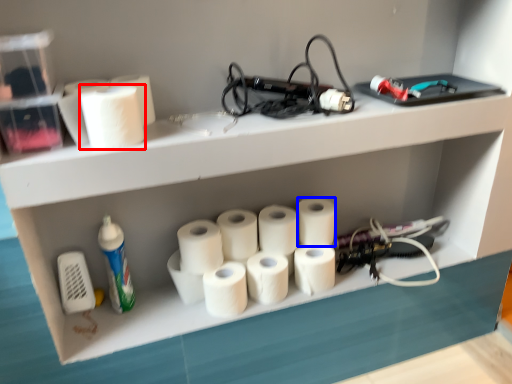
Question: Among these objects, which one is farthest to the camera, paper towel (highlighted by a red box) or paper towel (highlighted by a blue box)?

Choices:
 (A) paper towel
 (B) paper towel

Answer: (B)